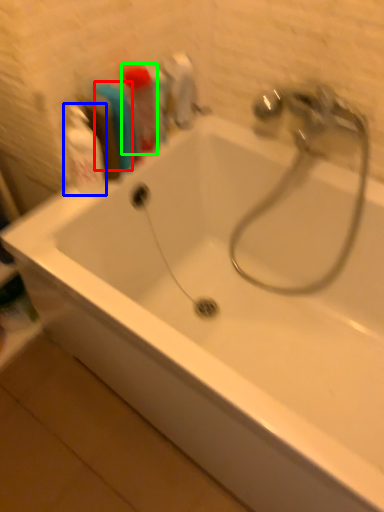
Question: Which is nearer to the toiletry (highlighted by a red box)? cleaning product (highlighted by a blue box) or toiletry (highlighted by a green box).

Choices:
 (A) cleaning product
 (B) toiletry

Answer: (B)